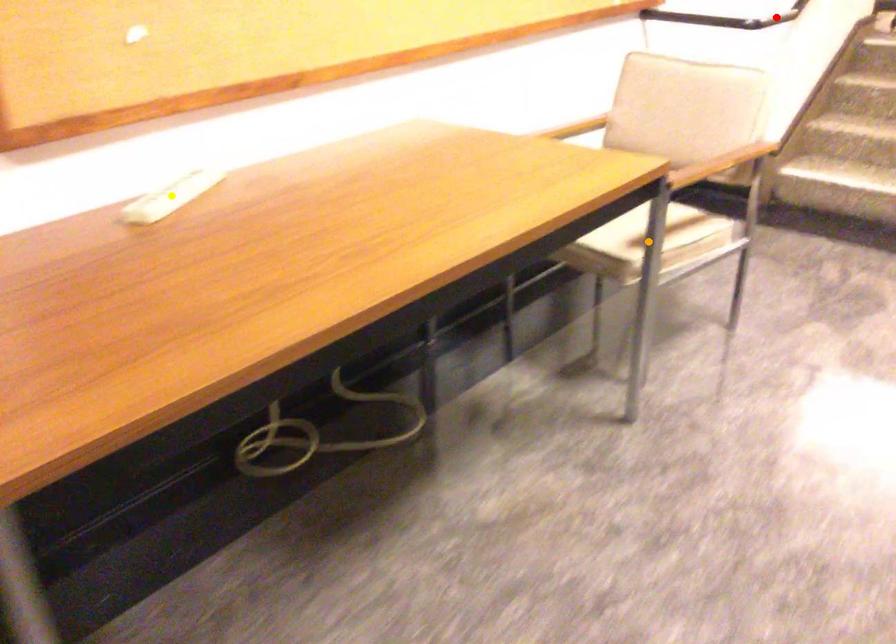
Order these from nearest to farthest:
red point
orange point
yellow point

yellow point
orange point
red point